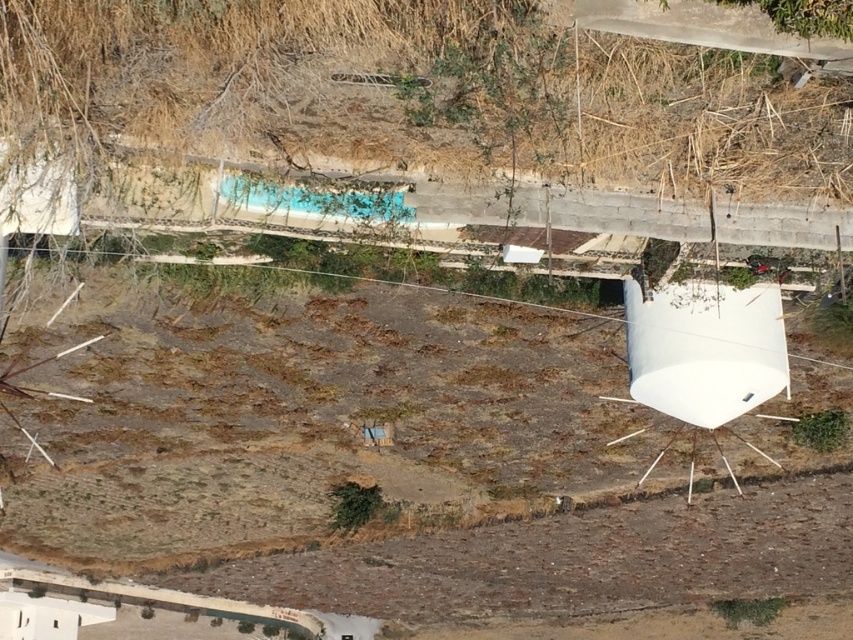
Does brown soil at center have a lesser height compared to dry grass at upper center?

No.

Can you confirm if brown soil at center is wider than dry grass at upper center?

Correct, the width of brown soil at center exceeds that of dry grass at upper center.

Identify the location of brown soil at center. The height and width of the screenshot is (640, 853). (398, 467).